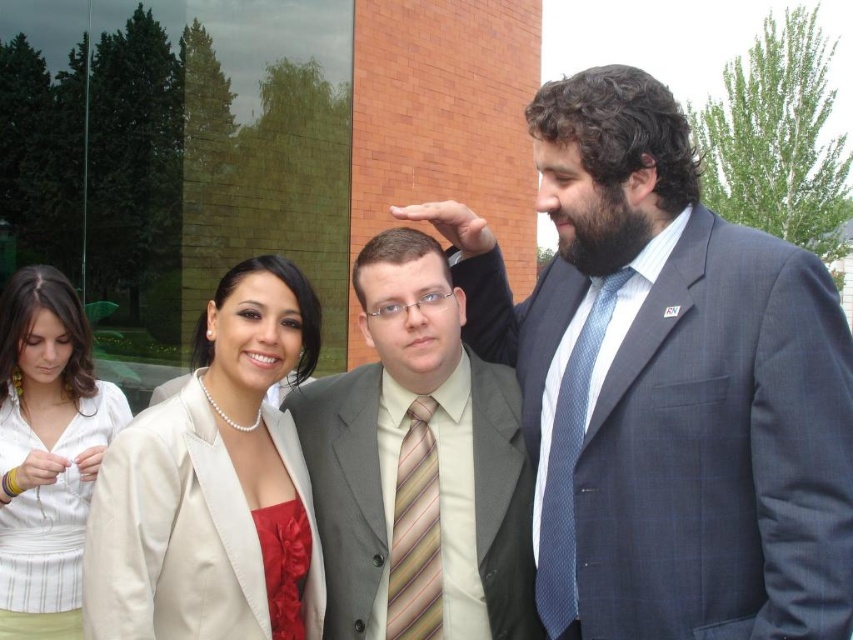
Question: Which of the following is the closest to the observer?

Choices:
 (A) striped tie at center
 (B) matte white blazer at center
 (C) blue textured suit at center

Answer: (C)

Question: Which point appears closest to the camera in this image?

Choices:
 (A) (85, 420)
 (B) (413, 572)
 (C) (552, 422)
 (D) (798, 548)

Answer: (D)

Question: Is white striped shirt at left closer to the viewer compared to silky satin dress at center?

Choices:
 (A) no
 (B) yes

Answer: (A)

Question: Based on their relative distances, which object is nearer to the blue textured tie at center?

Choices:
 (A) striped silk tie at center
 (B) matte white blazer at center

Answer: (A)

Question: Can you confirm if blue textured suit at center is positioned to the left of blue textured tie at center?

Choices:
 (A) no
 (B) yes

Answer: (A)

Question: Is matte white blazer at center in front of striped silk tie at center?

Choices:
 (A) no
 (B) yes

Answer: (B)